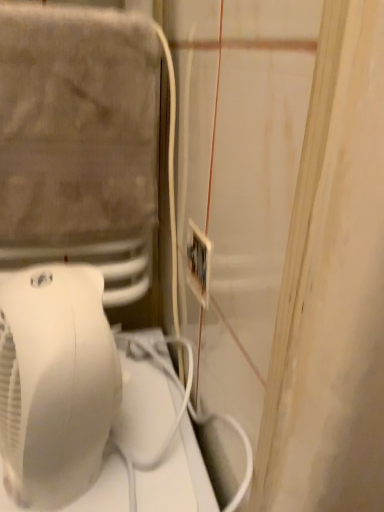
Describe the element at coordinates (55, 383) in the screenshot. I see `white plastic fan at left` at that location.

The height and width of the screenshot is (512, 384). Find the location of `white plastic fan at left`. white plastic fan at left is located at coordinates (55, 383).

In order to face white plastic fan at left, should I rotate leftwards or rightwards?

Rotate left and turn 20.821 degrees.

The width and height of the screenshot is (384, 512). Describe the element at coordinates (198, 263) in the screenshot. I see `white plastic electric outlet at center` at that location.

Where is `white plastic electric outlet at center`? The width and height of the screenshot is (384, 512). white plastic electric outlet at center is located at coordinates (198, 263).

This screenshot has height=512, width=384. In order to click on white plastic fan at left in this screenshot , I will do `click(55, 383)`.

Which object is positioned more to the left, white plastic electric outlet at center or white plastic fan at left?

white plastic fan at left.

Which is behind, white plastic electric outlet at center or white plastic fan at left?

white plastic electric outlet at center is further away from the camera.

Does point (195, 290) come in front of point (98, 302)?

No, (195, 290) is further to viewer.

From the image's perspective, between white plastic electric outlet at center and white plastic fan at left, who is located below?

white plastic fan at left.

From a real-world perspective, between white plastic electric outlet at center and white plastic fan at left, who is vertically lower?

white plastic fan at left is physically lower.

Is white plastic electric outlet at center wider or thinner than white plastic fan at left?

Clearly, white plastic electric outlet at center has less width compared to white plastic fan at left.

Considering the sizes of white plastic electric outlet at center and white plastic fan at left in the image, is white plastic electric outlet at center taller or shorter than white plastic fan at left?

In the image, white plastic electric outlet at center appears to be shorter than white plastic fan at left.

Based on their sizes in the image, would you say white plastic electric outlet at center is bigger or smaller than white plastic fan at left?

Clearly, white plastic electric outlet at center is smaller in size than white plastic fan at left.

Is white plastic electric outlet at center inside the boundaries of white plastic fan at left, or outside?

white plastic electric outlet at center is spatially situated outside white plastic fan at left.

In the scene shown: Is white plastic electric outlet at center far from white plastic fan at left?

No, white plastic electric outlet at center is not far from white plastic fan at left.

Is white plastic electric outlet at center facing away from white plastic fan at left?

No, white plastic electric outlet at center is not facing the opposite direction of white plastic fan at left.

Identify the location of electric outlet above the white plastic fan at left (from a real-world perspective). (198, 263).

In the image, is white plastic fan at left on the left side or the right side of white plastic electric outlet at center?

white plastic fan at left is positioned on white plastic electric outlet at center's left side.

In the image, is white plastic fan at left positioned in front of or behind white plastic electric outlet at center?

Visually, white plastic fan at left is located in front of white plastic electric outlet at center.

Is point (117, 364) less distant than point (207, 270)?

Yes, it is in front of point (207, 270).

From the image's perspective, would you say white plastic fan at left is positioned over white plastic electric outlet at center?

Actually, white plastic fan at left appears below white plastic electric outlet at center in the image.

From a real-world perspective, is white plastic fan at left below white plastic electric outlet at center?

Yes.

Can you confirm if white plastic fan at left is thinner than white plastic electric outlet at center?

Incorrect, the width of white plastic fan at left is not less than that of white plastic electric outlet at center.

Does white plastic fan at left have a lesser height compared to white plastic electric outlet at center?

No, white plastic fan at left is not shorter than white plastic electric outlet at center.

Does white plastic fan at left have a larger size compared to white plastic electric outlet at center?

Indeed, white plastic fan at left has a larger size compared to white plastic electric outlet at center.

Which is correct: white plastic fan at left is inside white plastic electric outlet at center, or outside of it?

white plastic fan at left exists outside the volume of white plastic electric outlet at center.

Is white plastic fan at left not near white plastic electric outlet at center?

white plastic fan at left is near white plastic electric outlet at center, not far away.

Is white plastic fan at left oriented towards white plastic electric outlet at center?

No, white plastic fan at left is not oriented towards white plastic electric outlet at center.

At what (x,y) coordinates should I click in order to perform the action: click on home appliance below the white plastic electric outlet at center (from the image's perspective). Please return your answer as a coordinate pair (x, y). This screenshot has height=512, width=384. Looking at the image, I should click on (55, 383).

The image size is (384, 512). I want to click on home appliance located underneath the white plastic electric outlet at center (from a real-world perspective), so click(x=55, y=383).

The image size is (384, 512). I want to click on home appliance lying on the left of white plastic electric outlet at center, so click(55, 383).